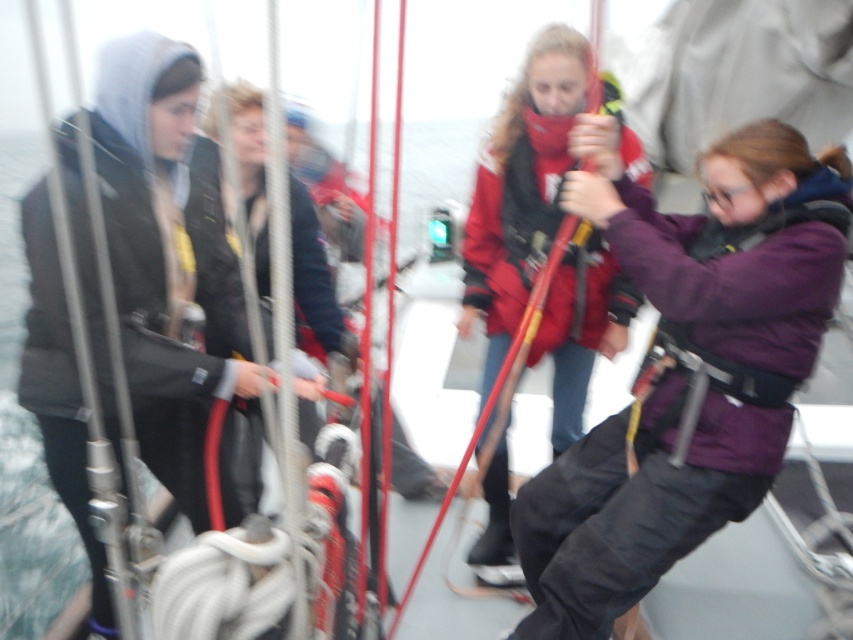
Which is more to the left, purple fleece jacket at center or matte black jacket at left?

Positioned to the left is matte black jacket at left.

This screenshot has width=853, height=640. I want to click on purple fleece jacket at center, so click(689, 371).

Image resolution: width=853 pixels, height=640 pixels. What do you see at coordinates (689, 371) in the screenshot? I see `purple fleece jacket at center` at bounding box center [689, 371].

I want to click on purple fleece jacket at center, so click(689, 371).